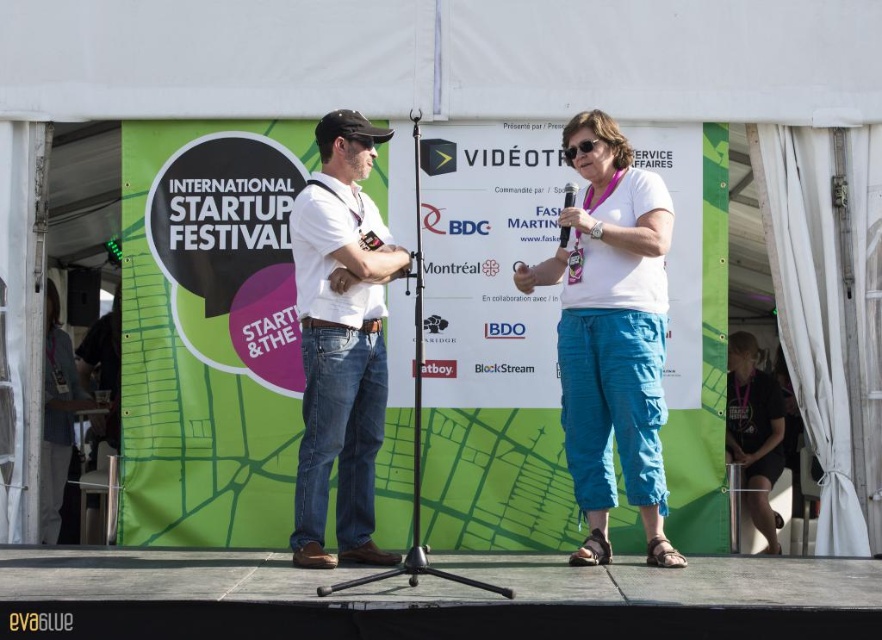
Can you confirm if white cotton shirt at center is positioned above black plastic microphone at center?

No, white cotton shirt at center is not above black plastic microphone at center.

Is white cotton shirt at center further to camera compared to black plastic microphone at center?

No, white cotton shirt at center is in front of black plastic microphone at center.

Find the location of `white cotton shirt at center`. white cotton shirt at center is located at coordinates (341, 340).

Does white cotton t-shirt at center have a lesser width compared to white cotton shirt at center?

No.

Is point (558, 356) more distant than point (305, 493)?

Yes, point (558, 356) is farther from viewer.

You are a GUI agent. You are given a task and a screenshot of the screen. Output one action in this format:
    pyautogui.click(x=<x>, y=<y>)
    Task: Click on the white cotton t-shirt at center
    The image size is (882, 640).
    Given the screenshot: What is the action you would take?
    pyautogui.click(x=611, y=333)

Between black fabric at lower right and black plastic microphone at center, which one appears on the left side from the viewer's perspective?

From the viewer's perspective, black plastic microphone at center appears more on the left side.

Is point (724, 404) farther from camera compared to point (564, 225)?

Yes, point (724, 404) is behind point (564, 225).

This screenshot has height=640, width=882. I want to click on black fabric at lower right, so 753,433.